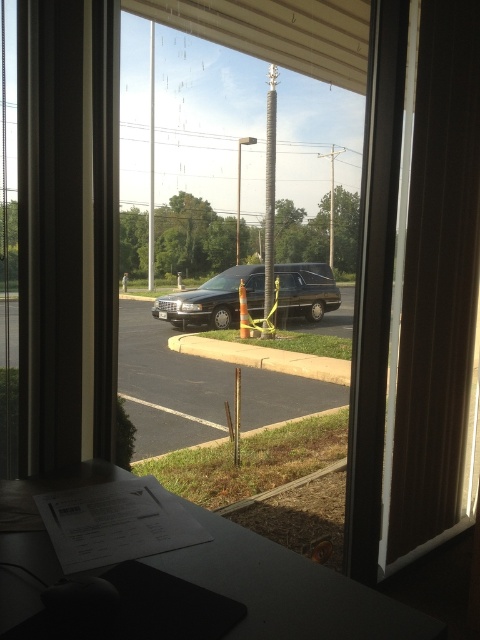
From the picture: Between black glossy car at center and black matte hearse at center, which one has more height?

black matte hearse at center

Is black glossy car at center positioned in front of black matte hearse at center?

Yes, it is.

This screenshot has height=640, width=480. I want to click on black glossy car at center, so click(168, 385).